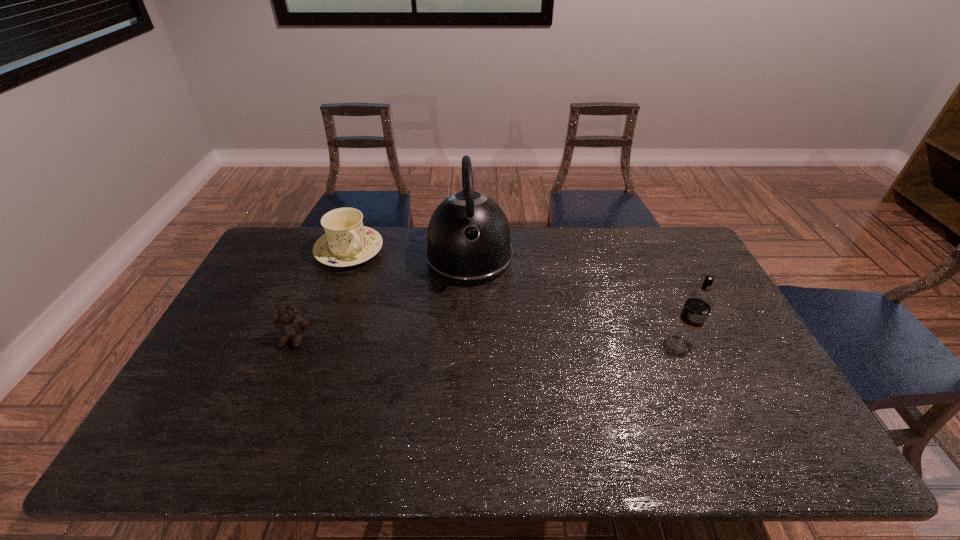
Where is `vacant area situated on the spout of the tallest object`? vacant area situated on the spout of the tallest object is located at coordinates (480, 366).

Find the location of a particular element. This screenshot has height=540, width=960. vacant space located 0.230m on the handle side of the chinaware is located at coordinates (402, 303).

Where is `vacant area situated 0.340m on the handle side of the chinaware`? The width and height of the screenshot is (960, 540). vacant area situated 0.340m on the handle side of the chinaware is located at coordinates (421, 323).

Where is `free space located 0.200m on the handle side of the chinaware`? This screenshot has width=960, height=540. free space located 0.200m on the handle side of the chinaware is located at coordinates (396, 298).

This screenshot has width=960, height=540. What are the coordinates of `kettle that is at the far edge` in the screenshot? It's located at (468, 243).

The height and width of the screenshot is (540, 960). I want to click on chinaware located at the far edge, so click(x=346, y=242).

Identify the location of object at the right edge. (699, 302).

In order to click on vacant region at the far edge of the desktop in this screenshot , I will do pos(562,261).

This screenshot has height=540, width=960. In the image, there is a desktop. What are the coordinates of `vacant space at the near edge` in the screenshot? It's located at (402, 399).

Identify the location of vacant space at the left edge of the desktop. The height and width of the screenshot is (540, 960). (259, 346).